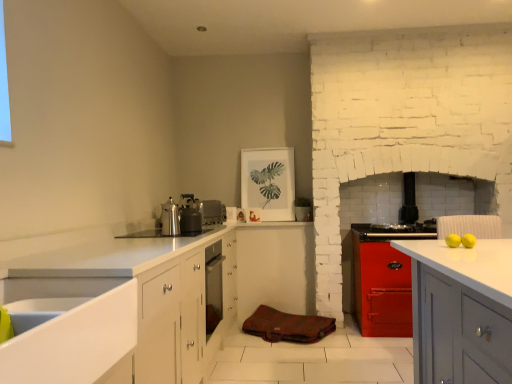
Question: Is white glossy sink at lower left to the left of shiny metallic kettle at center from the viewer's perspective?

Choices:
 (A) no
 (B) yes

Answer: (B)

Question: Does white glossy sink at lower left lie in front of shiny metallic kettle at center?

Choices:
 (A) no
 (B) yes

Answer: (B)

Question: Is white glossy sink at lower left bigger than shiny metallic kettle at center?

Choices:
 (A) no
 (B) yes

Answer: (B)

Question: Considering the relative sizes of white glossy sink at lower left and shiny metallic kettle at center in the image provided, is white glossy sink at lower left taller than shiny metallic kettle at center?

Choices:
 (A) yes
 (B) no

Answer: (A)

Question: Is shiny metallic kettle at center surrounded by white glossy sink at lower left?

Choices:
 (A) no
 (B) yes

Answer: (A)

Question: From a real-world perspective, is metallic stove at center, arranged as the 1th appliance when viewed from the right, physically located above or below shiny metallic kettle at center?

Choices:
 (A) below
 (B) above

Answer: (B)

Question: Based on their sizes in the image, would you say metallic stove at center, which appears as the 3th appliance when viewed from the left, is bigger or smaller than shiny metallic kettle at center?

Choices:
 (A) big
 (B) small

Answer: (A)

Question: From the image's perspective, is metallic stove at center, which is the 1th appliance from back to front, positioned above or below shiny metallic kettle at center?

Choices:
 (A) above
 (B) below

Answer: (A)

Question: Considering the positions of metallic stove at center, which appears as the 3th appliance when viewed from the left, and shiny metallic kettle at center in the image, is metallic stove at center, which appears as the 3th appliance when viewed from the left, wider or thinner than shiny metallic kettle at center?

Choices:
 (A) wide
 (B) thin

Answer: (A)

Question: In the image, is brown leather bag at center positioned in front of or behind metallic silver kettle at upper center, the third appliance in the right-to-left sequence?

Choices:
 (A) front
 (B) behind

Answer: (B)

Question: In terms of width, does brown leather bag at center look wider or thinner when compared to metallic silver kettle at upper center, the third appliance in the right-to-left sequence?

Choices:
 (A) thin
 (B) wide

Answer: (B)

Question: Considering the positions of brown leather bag at center and metallic silver kettle at upper center, the third appliance in the right-to-left sequence, in the image, is brown leather bag at center taller or shorter than metallic silver kettle at upper center, the third appliance in the right-to-left sequence,?

Choices:
 (A) short
 (B) tall

Answer: (A)

Question: Considering the positions of brown leather bag at center and metallic silver kettle at upper center, the third appliance in the right-to-left sequence, in the image, is brown leather bag at center bigger or smaller than metallic silver kettle at upper center, the third appliance in the right-to-left sequence,?

Choices:
 (A) big
 (B) small

Answer: (A)

Question: Visually, is metallic silver kettle at upper center, the third appliance in the back-to-front sequence, positioned to the left or to the right of brown leather bag at center?

Choices:
 (A) left
 (B) right

Answer: (A)

Question: Relative to brown leather bag at center, is metallic silver kettle at upper center, arranged as the first appliance when viewed from the front, in front or behind?

Choices:
 (A) front
 (B) behind

Answer: (A)